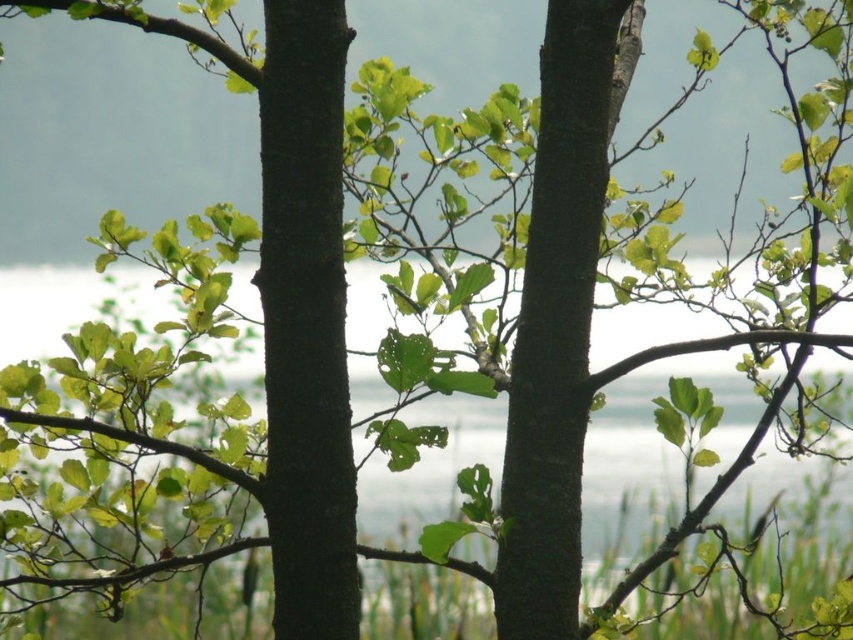
You are a hiker who wants to climb the tree trunks. Which tree trunk, the dark brown rough tree trunk at center or the smooth bark tree trunk at center, is easier to climb?

The dark brown rough tree trunk at center is easier to climb because it has a rough texture, providing better grip compared to the smooth bark tree trunk at center.

Based on the photo, you are a photographer aiming to capture the dark brown rough tree trunk at center and the smooth bark tree trunk at center in focus. Given the shallow depth of field, which trunk would be in sharper focus?

The dark brown rough tree trunk at center is closer to the viewer than the smooth bark tree trunk at center, so it would be in sharper focus due to the shallow depth of field.

You are a hiker trying to identify the tallest tree trunk between the dark brown rough tree trunk at center and the smooth bark tree trunk at center. Which one should you choose?

The smooth bark tree trunk at center is taller than the dark brown rough tree trunk at center, so you should choose the smooth bark tree trunk at center.